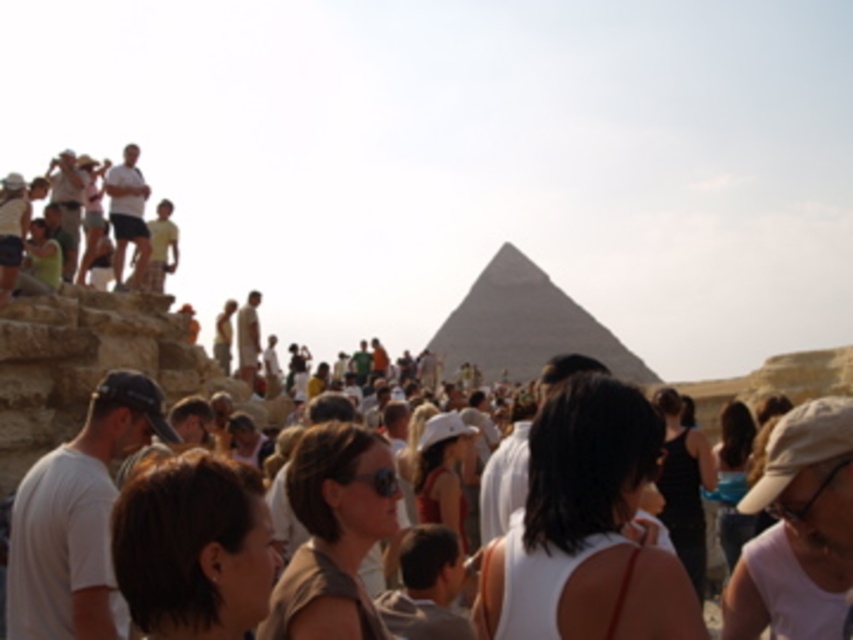
Question: Which object is closer to the camera taking this photo?

Choices:
 (A) brown suede jacket at center
 (B) white fabric cap at center

Answer: (A)

Question: Considering the real-world distances, which object is closest to the white cotton shirt at left?

Choices:
 (A) gray stone pyramid at center
 (B) dark brown hair at center
 (C) white fabric dress at center
 (D) brown suede jacket at center

Answer: (B)

Question: Is white fabric cap at center to the right of gray stone pyramid at center from the viewer's perspective?

Choices:
 (A) yes
 (B) no

Answer: (B)

Question: Which of the following is the closest to the observer?

Choices:
 (A) (633, 378)
 (B) (310, 435)

Answer: (B)

Question: Can you confirm if white cotton shirt at left is positioned to the right of brown suede jacket at center?

Choices:
 (A) no
 (B) yes

Answer: (A)

Question: Does white cotton shirt at left appear on the right side of gray stone pyramid at center?

Choices:
 (A) yes
 (B) no

Answer: (B)